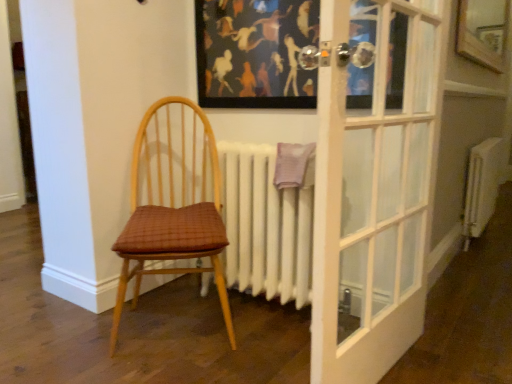
Identify the location of free space to the left of wooden chair with woven seat cushion at left. This screenshot has width=512, height=384. (57, 341).